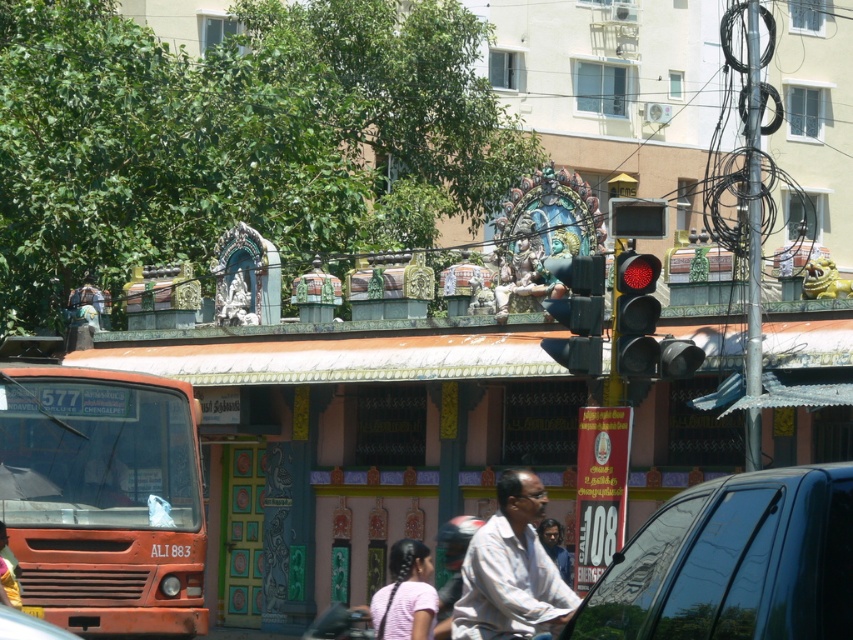
Which of these two, matte orange bus at left or light pink fabric at lower center, stands shorter?

light pink fabric at lower center is shorter.

Who is lower down, matte orange bus at left or light pink fabric at lower center?

light pink fabric at lower center is lower down.

Locate an element on the screen. matte orange bus at left is located at coordinates (103, 497).

Find the location of a particular element. The height and width of the screenshot is (640, 853). matte orange bus at left is located at coordinates (103, 497).

Locate an element on the screen. The image size is (853, 640). shiny black car at center is located at coordinates (734, 563).

Is point (712, 637) more distant than point (416, 580)?

No, it is not.

I want to click on shiny black car at center, so click(734, 563).

Does point (55, 630) lie behind point (12, 593)?

No.

Who is more distant from viewer, (x=10, y=627) or (x=6, y=586)?

Positioned behind is point (x=6, y=586).

The height and width of the screenshot is (640, 853). Identify the location of metallic orange truck at lower left. (28, 627).